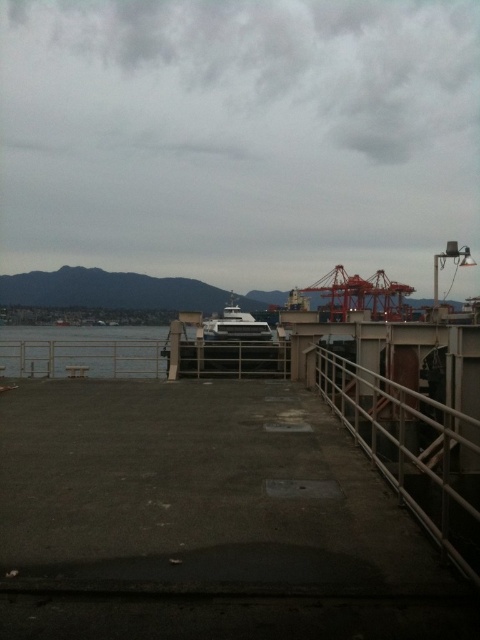
Question: Does gray concrete dock at center appear under white glossy boat at center?

Choices:
 (A) no
 (B) yes

Answer: (B)

Question: Is metal/rustic rail at right thinner than clear water at left?

Choices:
 (A) yes
 (B) no

Answer: (A)

Question: Which of the following is the closest to the observer?

Choices:
 (A) (248, 317)
 (B) (88, 332)

Answer: (A)

Question: Which object appears farthest from the camera in this image?

Choices:
 (A) gray concrete dock at center
 (B) metal/rustic rail at right

Answer: (B)

Question: Which object is the closest to the metal/rustic rail at right?

Choices:
 (A) gray concrete dock at center
 (B) clear water at left

Answer: (A)

Question: Observing the image, what is the correct spatial positioning of clear water at left in reference to red metallic crane at center?

Choices:
 (A) right
 (B) left

Answer: (B)